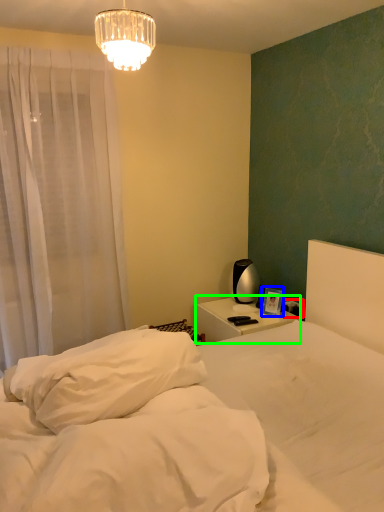
Question: Which object is the farthest from electric outlet (highlighted by a red box)? Choose among these: picture frame (highlighted by a blue box) or nightstand (highlighted by a green box).

Choices:
 (A) picture frame
 (B) nightstand

Answer: (B)